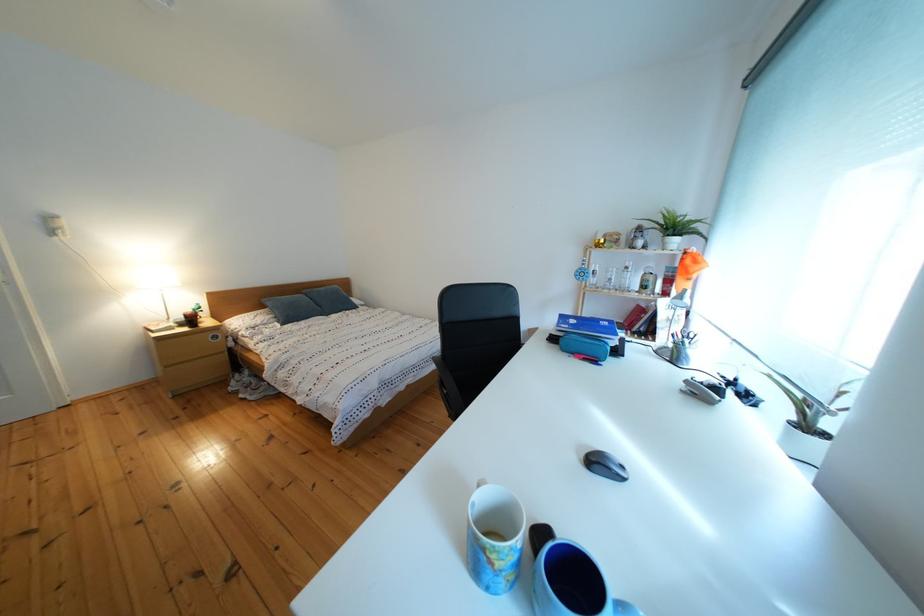
I want to click on black computer mouse, so click(604, 464).